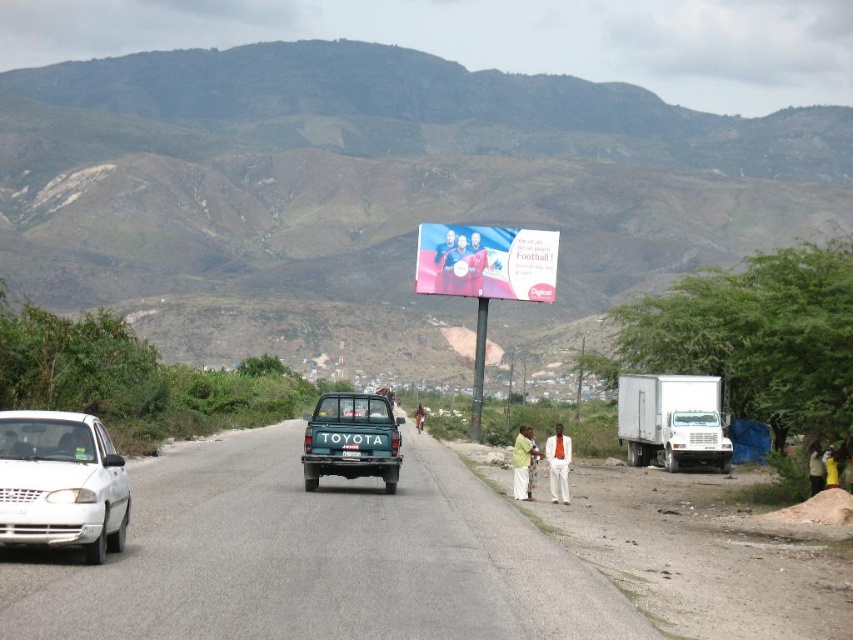
You are a driver approaching the road and notice two billboards ahead. The white plastic billboard at center and the blue fabric billboard at center. Which one is taller?

The white plastic billboard at center is taller than the blue fabric billboard at center.

You are a photographer trying to capture a candid shot of the two men on the right side of the road. You notice the light green fabric shirt at right and the brown leather jacket at center. Which of these two clothing items is smaller in size?

The light green fabric shirt at right has a smaller size compared to the brown leather jacket at center.

You are a driver approaching the intersection where the white plastic billboard at center and the blue fabric billboard at center are located. Which billboard will you see first as you drive towards the intersection?

The white plastic billboard at center is bigger than the blue fabric billboard at center, but size does not determine visibility order. Since both billboards are at the same center position, they would be visible at the same time as you approach the intersection.